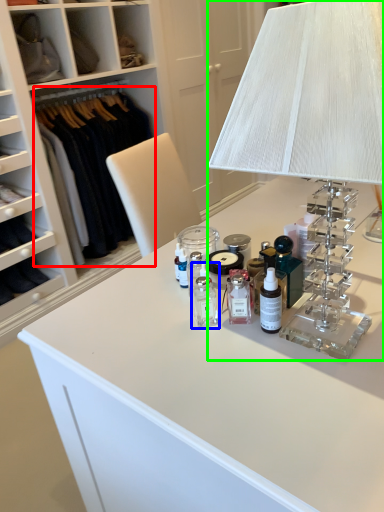
Question: Which object is positioned farthest from clothing (highlighted by a red box)? Select from toiletry (highlighted by a blue box) and table lamp (highlighted by a green box).

Choices:
 (A) toiletry
 (B) table lamp

Answer: (B)